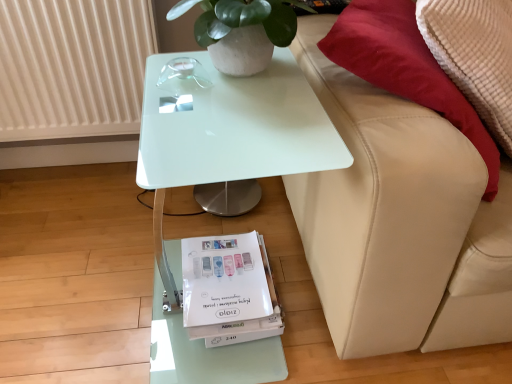
Where is `vacant space situated above white paper magazine at lower center (from a real-world perspective)`? The height and width of the screenshot is (384, 512). vacant space situated above white paper magazine at lower center (from a real-world perspective) is located at coordinates (228, 271).